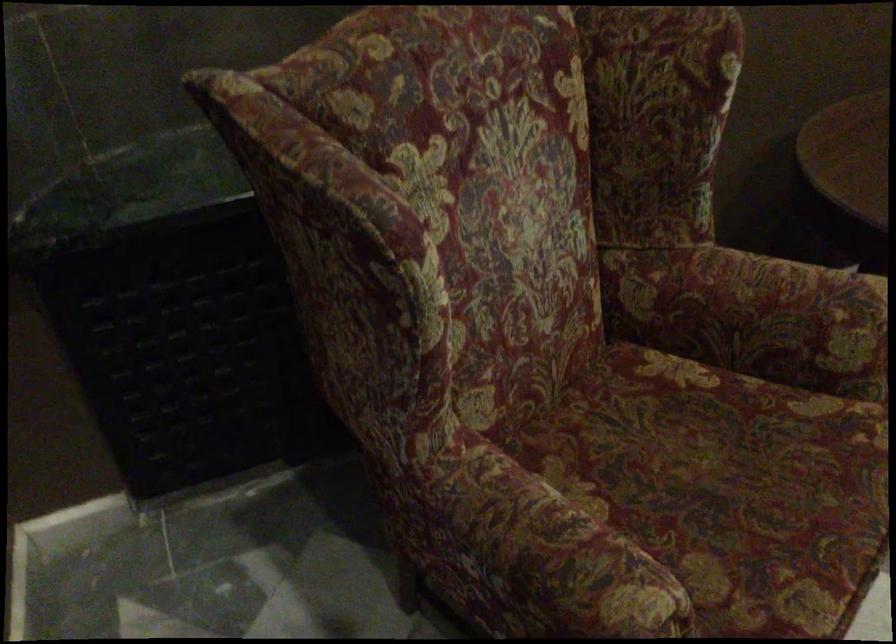
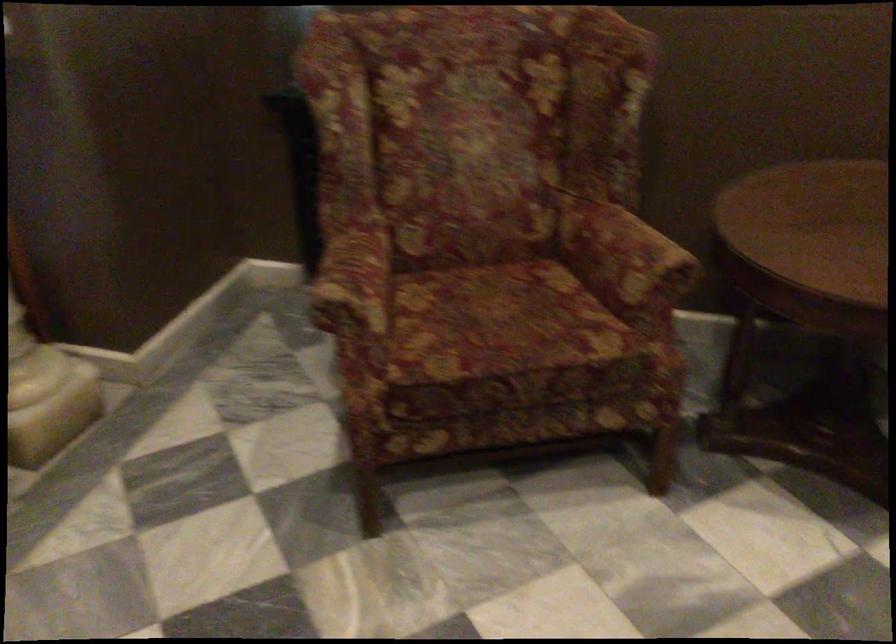
Where in the second image is the point corresponding to (743,484) from the first image?

(501, 323)